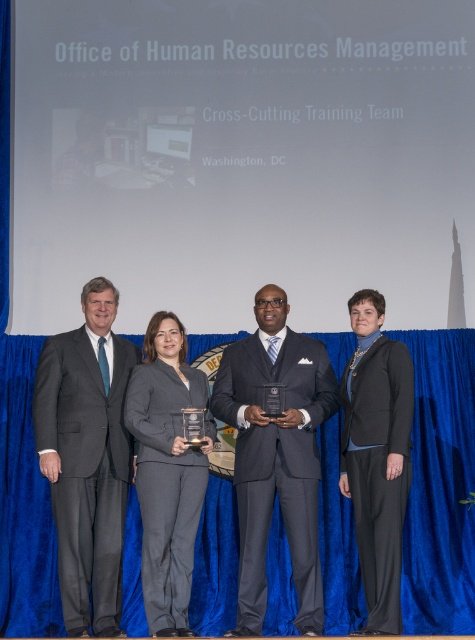
Is charcoal gray suit at left thinner than matte black suit at center?

Yes, charcoal gray suit at left is thinner than matte black suit at center.

Describe the element at coordinates (86, 458) in the screenshot. Image resolution: width=475 pixels, height=640 pixels. I see `charcoal gray suit at left` at that location.

Find the location of `charcoal gray suit at left`. charcoal gray suit at left is located at coordinates (86, 458).

Can you confirm if matte black suit at center is bigger than gray suit at center?

Yes.

Is matte black suit at center smaller than gray suit at center?

No.

The width and height of the screenshot is (475, 640). Identify the location of matte black suit at center. (275, 452).

Who is more forward, (57,445) or (173,509)?

Point (173,509)

Does point (46, 435) lie behind point (172, 348)?

No, (46, 435) is closer to viewer.

Between point (49, 410) and point (170, 424), which one is positioned in front?

Point (49, 410) is in front.

You are a GUI agent. You are given a task and a screenshot of the screen. Output one action in this format:
    pyautogui.click(x=<x>, y=<y>)
    Task: Click on the charcoal gray suit at left
    The image size is (475, 640).
    Given the screenshot: What is the action you would take?
    pyautogui.click(x=86, y=458)